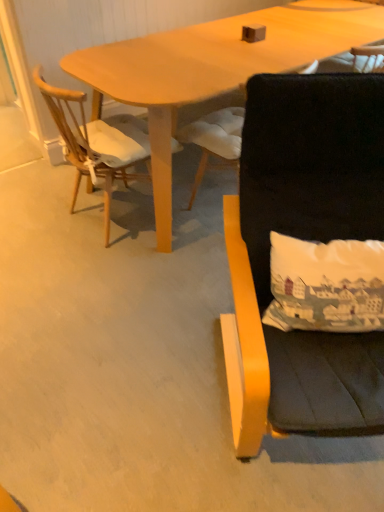
At what (x,y) coordinates should I click in order to perform the action: click on free space between black fabric chair at center, which is the second chair in right-to-left order, and wooden chair at left, marked as the 1th chair in a left-to-right arrangement. Please return your answer as a coordinate pair (x, y). Looking at the image, I should click on pos(175,230).